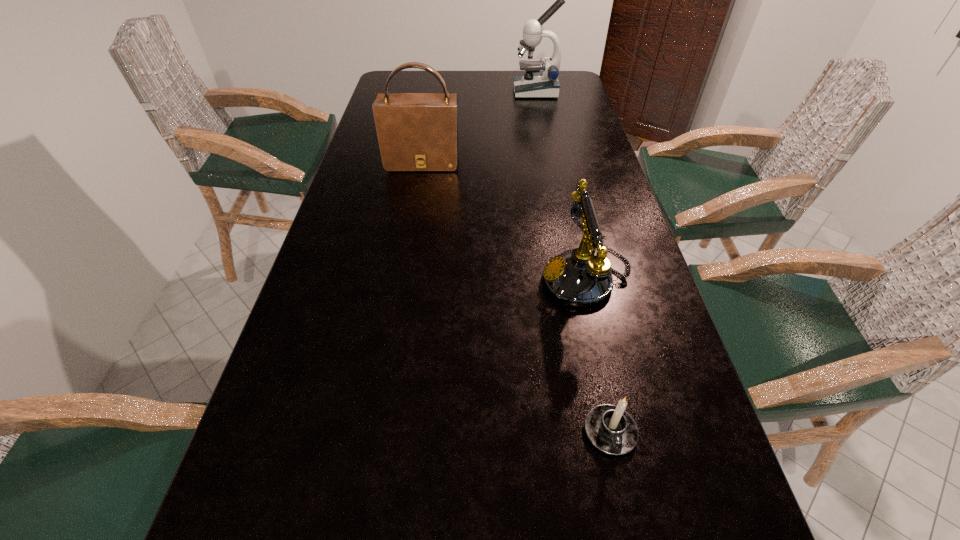
In the image, there is a desktop. Identify the location of free space at the left edge. This screenshot has width=960, height=540. (348, 183).

In the image, there is a desktop. Where is `vacant space at the right edge`? vacant space at the right edge is located at coordinates (558, 190).

Find the location of a particular element. The image size is (960, 540). free spot between the shortest object and the third nearest object is located at coordinates (x=516, y=297).

Locate an element on the screen. Image resolution: width=960 pixels, height=540 pixels. vacant area that lies between the third nearest object and the telephone is located at coordinates (504, 221).

The width and height of the screenshot is (960, 540). Find the location of `free space between the second shortest object and the microscope`. free space between the second shortest object and the microscope is located at coordinates (561, 185).

This screenshot has width=960, height=540. In order to click on vacant space that's between the third tallest object and the shortest object in this screenshot , I will do `click(598, 355)`.

What are the coordinates of `vacant region between the leftmost object and the nearest object` in the screenshot? It's located at (516, 297).

The height and width of the screenshot is (540, 960). In order to click on vacant space that is in between the microscope and the second farthest object in this screenshot , I will do `click(479, 127)`.

I want to click on vacant space in between the third nearest object and the telephone, so click(504, 221).

You are a GUI agent. You are given a task and a screenshot of the screen. Output one action in this format:
    pyautogui.click(x=<x>, y=<y>)
    Task: Click on the blank region between the shoulder bag and the shortest object
    This screenshot has width=960, height=540.
    Given the screenshot: What is the action you would take?
    pyautogui.click(x=516, y=297)